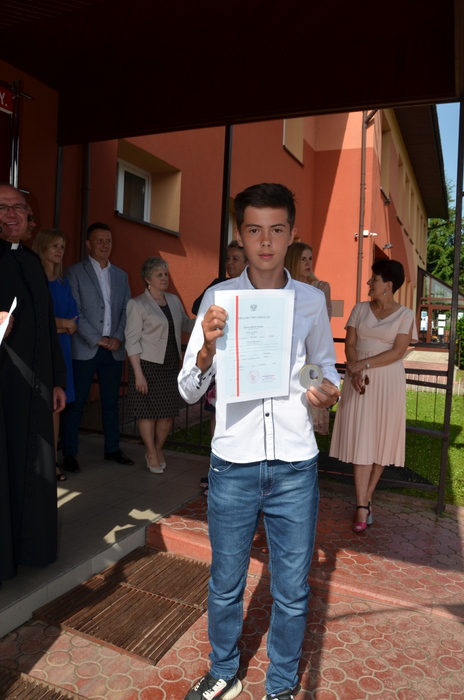
The image size is (464, 700). In order to click on paper with text on it in this screenshot , I will do `click(261, 339)`.